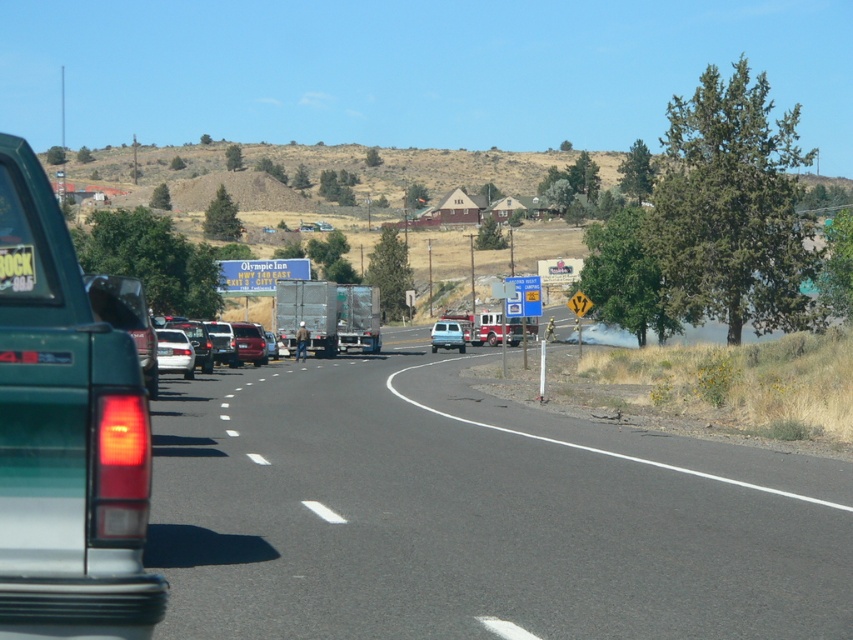
Can you confirm if black asphalt road at center is smaller than white plastic license plate at center?

No.

I want to click on black asphalt road at center, so click(474, 513).

Is point (119, 339) farther from camera compared to point (204, 356)?

No, (119, 339) is in front of (204, 356).

Between point (19, 579) and point (260, 342), which one is positioned in front?

Positioned in front is point (19, 579).

At what (x,y) coordinates should I click in order to perform the action: click on green matte truck at left. Please return your answer as a coordinate pair (x, y). This screenshot has width=853, height=640. Looking at the image, I should click on (65, 435).

Is green matte truck at left below white plastic license plate at center?

Incorrect, green matte truck at left is not positioned below white plastic license plate at center.

Image resolution: width=853 pixels, height=640 pixels. What do you see at coordinates (65, 435) in the screenshot?
I see `green matte truck at left` at bounding box center [65, 435].

The height and width of the screenshot is (640, 853). Find the location of `green matte truck at left`. green matte truck at left is located at coordinates (65, 435).

Where is `green matte truck at left`? The width and height of the screenshot is (853, 640). green matte truck at left is located at coordinates (65, 435).